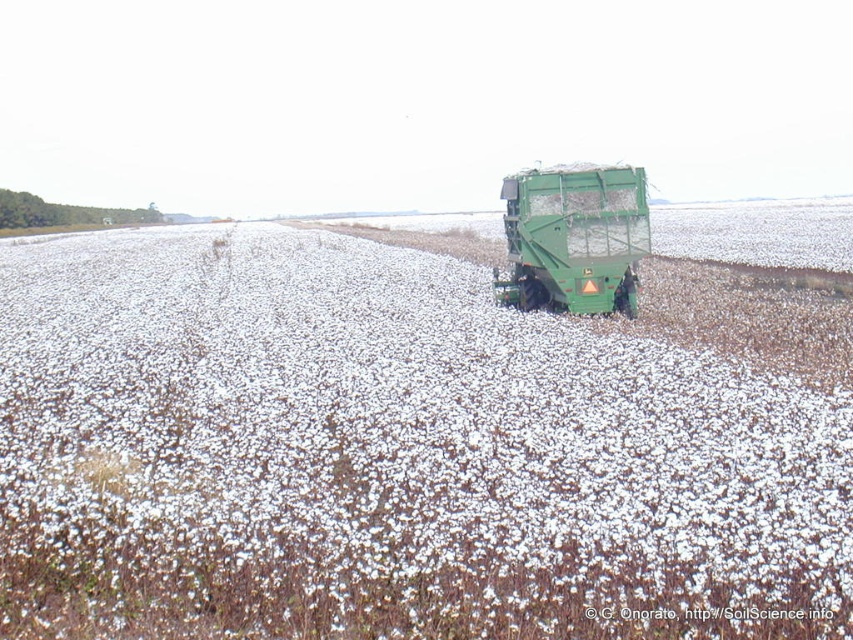
You are a farmer standing at the edge of the field. You want to drive your green matte truck at center to the edge to unload cotton. However, you notice white fluffy cotton at center blocking the path. Can you drive around it without moving the cotton?

The white fluffy cotton at center is in front of the green matte truck at center, so the truck is behind the cotton. Since the cotton is blocking the path, you can drive around it by moving to the sides of the cotton, as the truck is positioned centrally and the cotton is in front, there is space on either side to maneuver around it without moving the cotton.

You are a farmer standing at the edge of the field. You need to determine if the green matte truck at center can fully cover the white fluffy cotton at center with a tarp. Based on their sizes, can the truck cover the cotton?

The white fluffy cotton at center has a greater height compared to the green matte truck at center, so the truck cannot fully cover the cotton with a tarp since the cotton is taller.